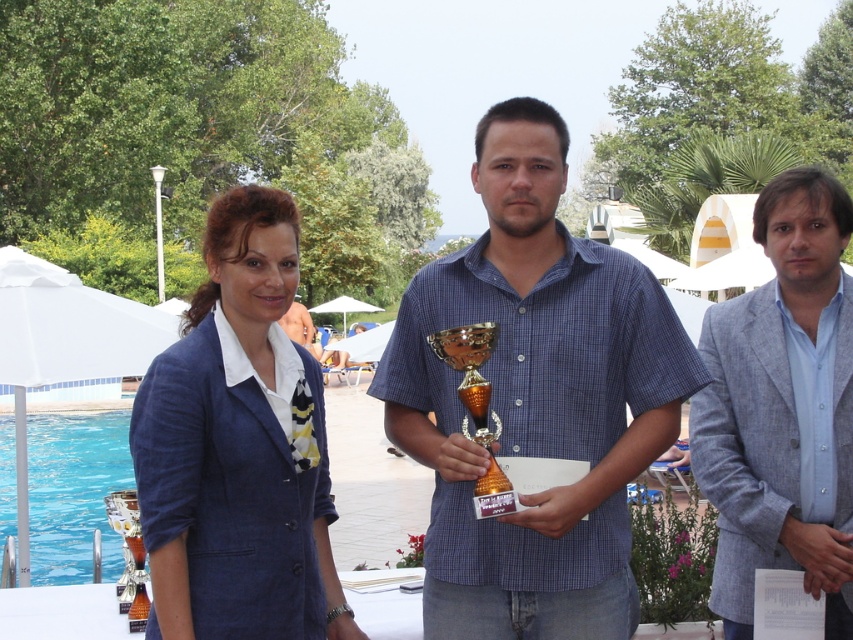
Question: Is blue checkered shirt at center positioned at the back of blue linen suit at center?

Choices:
 (A) no
 (B) yes

Answer: (B)

Question: Can you confirm if blue checkered shirt at center is positioned to the right of blue glass pool at lower left?

Choices:
 (A) yes
 (B) no

Answer: (A)

Question: Estimate the real-world distances between objects in this image. Which object is closer to the blue linen blazer at center?

Choices:
 (A) blue linen suit at center
 (B) gray textured blazer at right
 (C) blue glass pool at lower left

Answer: (A)

Question: Does blue checkered shirt at center lie in front of blue linen blazer at center?

Choices:
 (A) no
 (B) yes

Answer: (A)

Question: Which of the following is the closest to the observer?

Choices:
 (A) (113, 506)
 (B) (584, 422)
 (C) (218, 470)
 (D) (90, 416)

Answer: (C)

Question: Which object appears closest to the camera in this image?

Choices:
 (A) gold metallic trophy at center
 (B) shiny silver trophy at lower left
 (C) blue glass pool at lower left

Answer: (A)